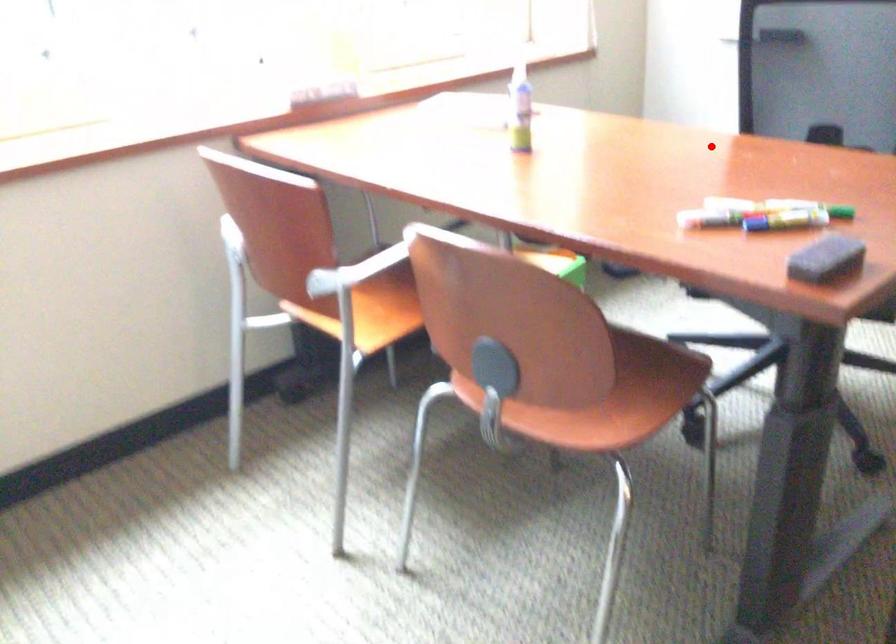
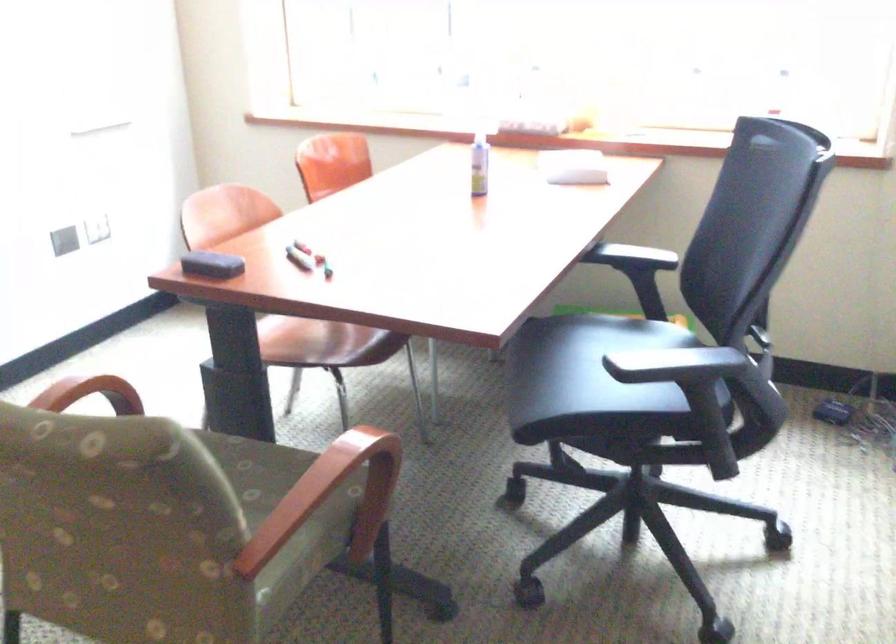
Question: I am providing you with two images of the same scene from different viewpoints. Given a red point in image1, look at the same physical point in image2. Is it:

Choices:
 (A) Closer to the viewpoint
 (B) Farther from the viewpoint

Answer: (B)